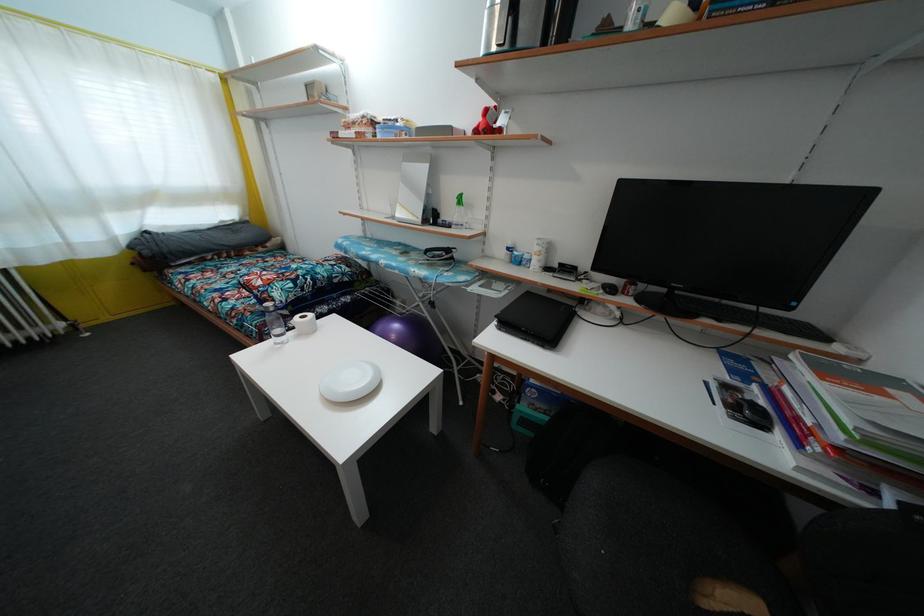
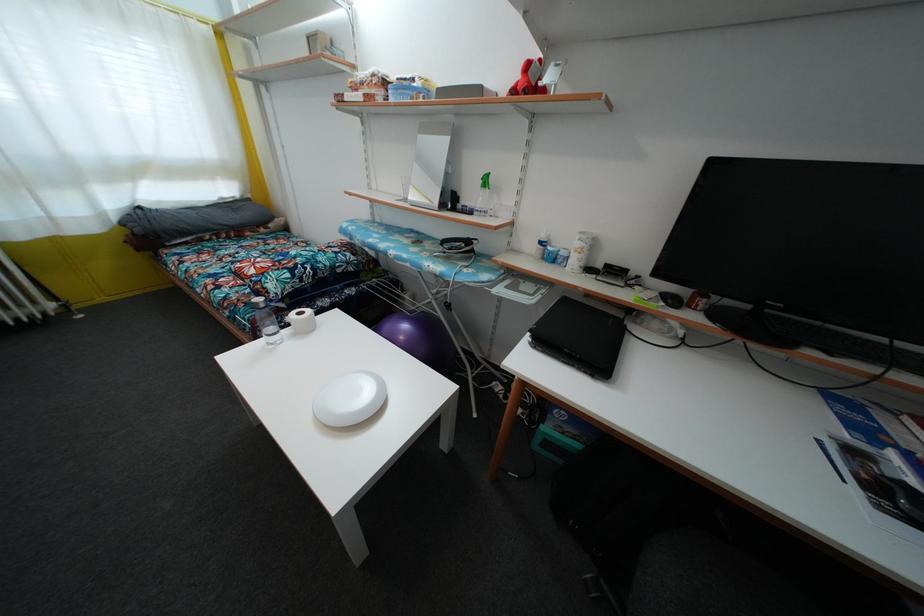
Question: Which direction would the cameraman need to move to produce the second image? Reply with the corresponding letter.

Choices:
 (A) Left
 (B) Right
 (C) Forward
 (D) Backward

Answer: (C)